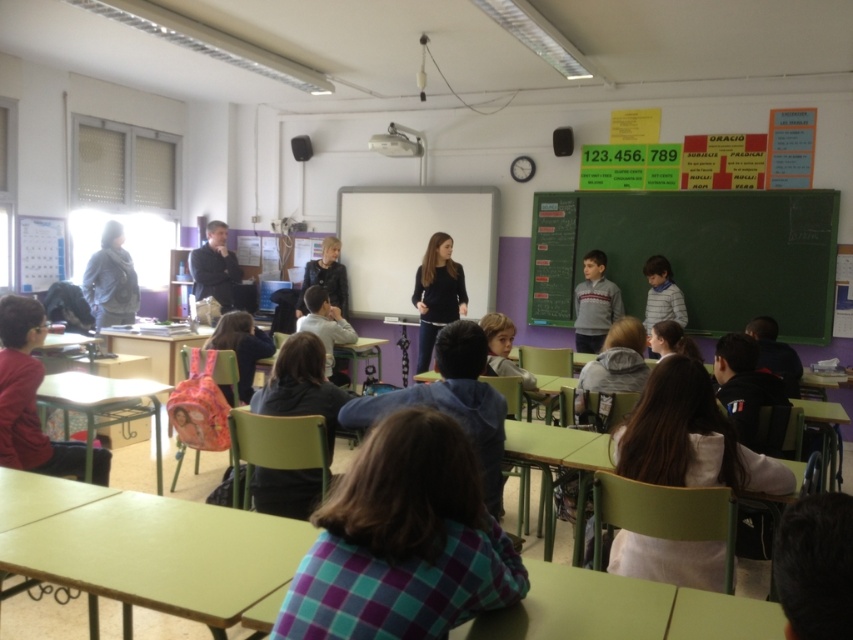
You are a student sitting in the classroom and want to look at both the point at coordinates point (236,275) and point (831,412). Which point will appear closer to your eyes?

The point at coordinates point (236,275) will appear closer to your eyes because it is further to the viewer than point (831,412).

You are a student who wants to place your backpack on the green plastic table at lower right. Can you reach it from your current position near the matte plastic backpack at center?

The green plastic table at lower right is behind the matte plastic backpack at center, so you would need to move around the backpack to access the table.

You are a student in the classroom and want to hand in your homework to the teacher wearing the dark blue suit at center. The green plastic table at lower right has a box labeled

The dark blue suit at center is smaller than the green plastic table at lower right, so the teacher might be standing closer to you than the table. You should approach the teacher directly to hand in your homework instead of placing it on the table.